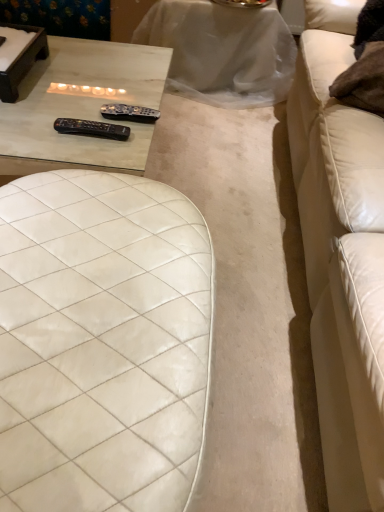
Question: Should I look upward or downward to see matte glass table at upper left, the second table viewed from the back?

Choices:
 (A) down
 (B) up

Answer: (B)

Question: Can you confirm if white quilted leather ottoman at center is taller than black plastic remote at center, which appears as the 2th remote when viewed from the back?

Choices:
 (A) yes
 (B) no

Answer: (A)

Question: Could you tell me if white quilted leather ottoman at center is turned towards black plastic remote at center, positioned as the 1th remote in front-to-back order?

Choices:
 (A) no
 (B) yes

Answer: (A)

Question: From the image's perspective, is white quilted leather ottoman at center located above black plastic remote at center, which appears as the 2th remote when viewed from the back?

Choices:
 (A) no
 (B) yes

Answer: (A)

Question: Considering the relative positions of white quilted leather ottoman at center and black plastic remote at center, which appears as the 2th remote when viewed from the back, in the image provided, is white quilted leather ottoman at center behind black plastic remote at center, which appears as the 2th remote when viewed from the back,?

Choices:
 (A) yes
 (B) no

Answer: (B)

Question: Is white quilted leather ottoman at center not inside black plastic remote at center, positioned as the 1th remote in front-to-back order?

Choices:
 (A) yes
 (B) no

Answer: (A)

Question: Would you say white quilted leather ottoman at center is a long distance from black plastic remote at center, positioned as the 1th remote in front-to-back order?

Choices:
 (A) no
 (B) yes

Answer: (A)

Question: Is black plastic remote at upper center, acting as the 2th remote starting from the front, facing away from white leather couch at right?

Choices:
 (A) yes
 (B) no

Answer: (B)

Question: Considering the relative sizes of black plastic remote at upper center, marked as the first remote in a back-to-front arrangement, and white leather couch at right in the image provided, is black plastic remote at upper center, marked as the first remote in a back-to-front arrangement, wider than white leather couch at right?

Choices:
 (A) yes
 (B) no

Answer: (B)

Question: Is black plastic remote at upper center, marked as the first remote in a back-to-front arrangement, shorter than white leather couch at right?

Choices:
 (A) yes
 (B) no

Answer: (A)

Question: From a real-world perspective, is black plastic remote at upper center, marked as the first remote in a back-to-front arrangement, positioned over white leather couch at right based on gravity?

Choices:
 (A) yes
 (B) no

Answer: (B)

Question: Can you confirm if black plastic remote at upper center, acting as the 2th remote starting from the front, is positioned to the left of white leather couch at right?

Choices:
 (A) yes
 (B) no

Answer: (A)

Question: Is black plastic remote at upper center, marked as the first remote in a back-to-front arrangement, completely or partially outside of white leather couch at right?

Choices:
 (A) no
 (B) yes

Answer: (B)

Question: Does white marble table at upper center, positioned as the second table in bottom-to-top order, lie in front of black plastic remote at upper center, marked as the first remote in a back-to-front arrangement?

Choices:
 (A) no
 (B) yes

Answer: (A)